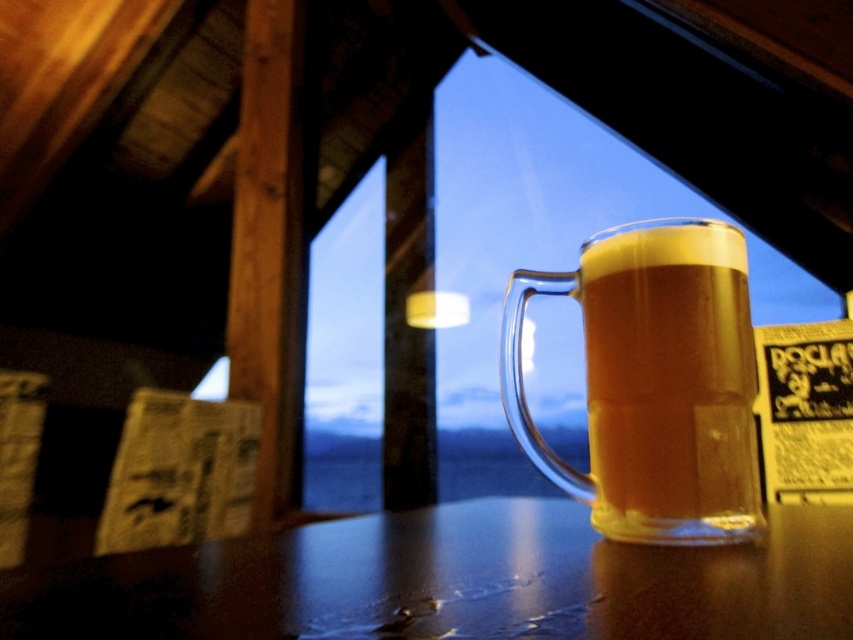
In the scene shown: You are a bartender preparing to place a coaster under the translucent glass mug at center. Considering the height of the shiny brown table at center, will the coaster fit underneath the mug without causing it to wobble?

The shiny brown table at center is not as tall as the translucent glass mug at center, meaning the table is shorter. Therefore, the coaster should fit under the mug without causing it to wobble.

You are standing at the entrance of the bar and want to place your coat on the shiny brown table at center. Based on the coordinates provided, is the table located closer to the front or the back of the room?

The shiny brown table at center is located closer to the back of the room since its coordinate x value is 0.911, which is closer to 1.0, indicating proximity to the back wall.

You are a customer at the bar and want to place your phone on the shiny brown table at center. However, there is already a translucent glass mug at center on it. Can you still place your phone on the table without moving the mug?

The shiny brown table at center is below the translucent glass mug at center, meaning the mug is currently occupying space on the table. Therefore, you can still place your phone on the remaining available area of the shiny brown table at center as long as there is enough space not covered by the mug.